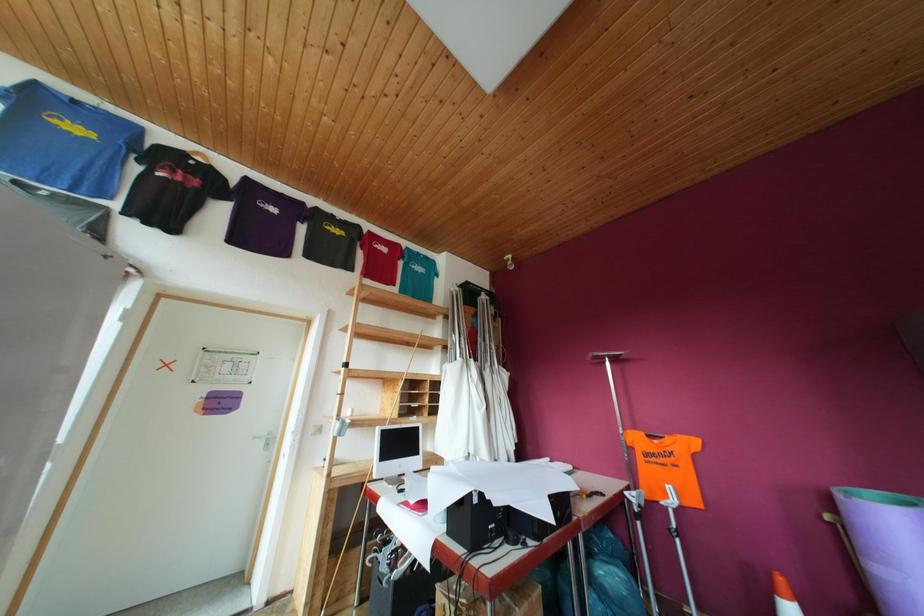
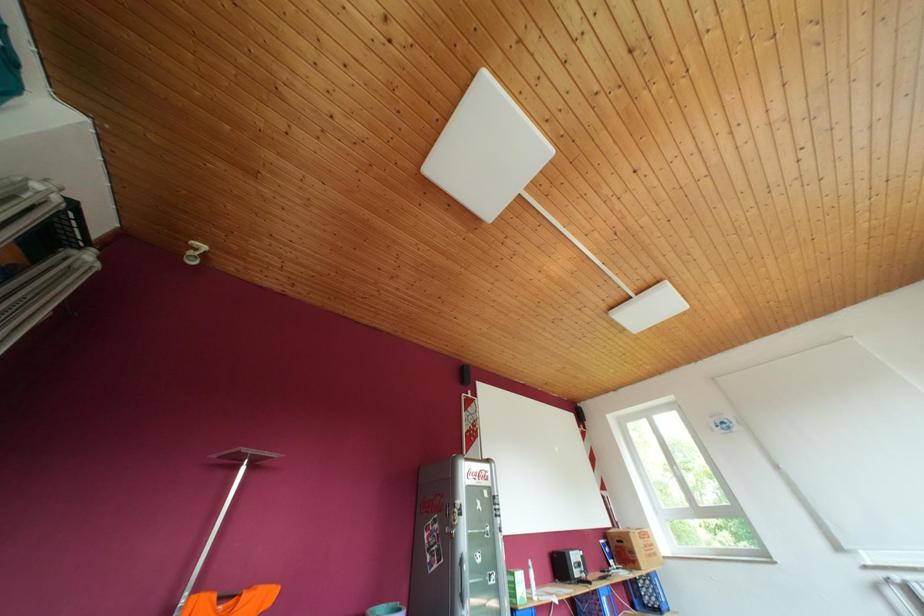
How did the camera likely rotate?

The camera's rotation is toward right-up.